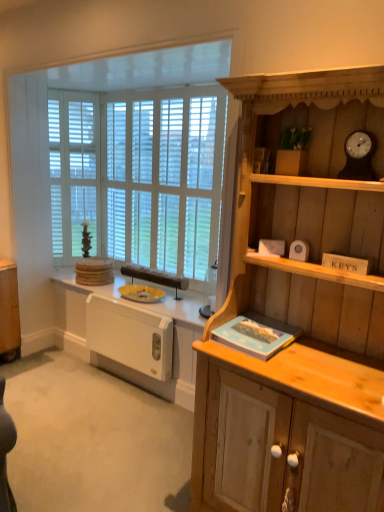
Locate an element on the screen. vacant area situated below white plastic radiator at lower left (from a real-world perspective) is located at coordinates (124, 385).